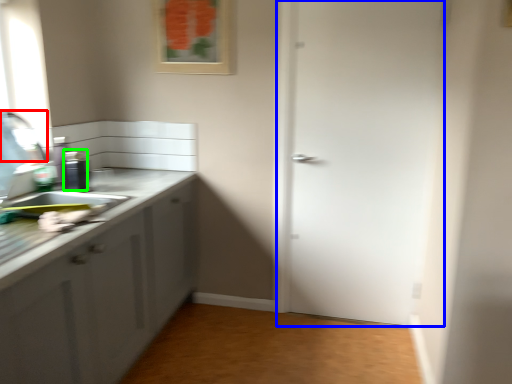
Question: Which is farther away from faucet (highlighted by a red box)? door (highlighted by a blue box) or appliance (highlighted by a green box)?

Choices:
 (A) door
 (B) appliance

Answer: (A)